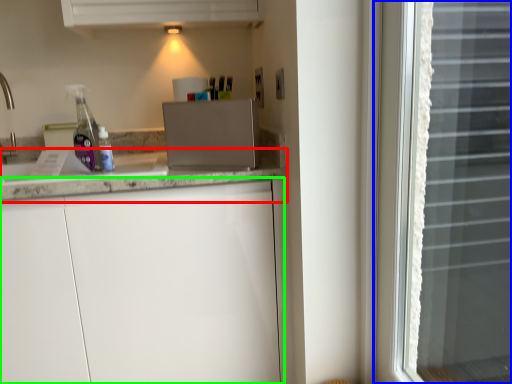
Question: Considering the real-world distances, which object is closest to countertop (highlighted by a red box)? window (highlighted by a blue box) or cabinetry (highlighted by a green box).

Choices:
 (A) window
 (B) cabinetry

Answer: (B)